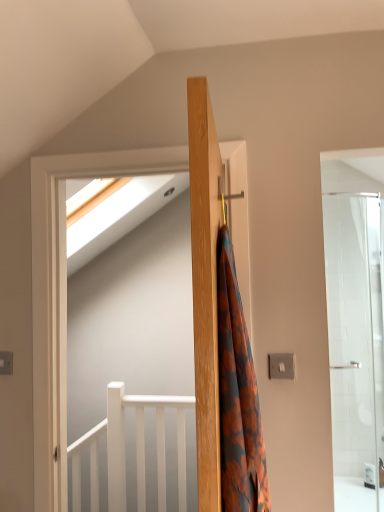
Question: From a real-world perspective, is white glossy screen door at upper left located beneath white matte balustrade at lower left?

Choices:
 (A) yes
 (B) no

Answer: (B)

Question: Is white glossy screen door at upper left outside of white matte balustrade at lower left?

Choices:
 (A) yes
 (B) no

Answer: (A)

Question: Is white glossy screen door at upper left at the left side of white matte balustrade at lower left?

Choices:
 (A) no
 (B) yes

Answer: (A)

Question: Is white glossy screen door at upper left to the right of white matte balustrade at lower left from the viewer's perspective?

Choices:
 (A) yes
 (B) no

Answer: (A)

Question: From the image's perspective, does white glossy screen door at upper left appear higher than white matte balustrade at lower left?

Choices:
 (A) yes
 (B) no

Answer: (A)

Question: Considering the relative sizes of white glossy screen door at upper left and white matte balustrade at lower left in the image provided, is white glossy screen door at upper left thinner than white matte balustrade at lower left?

Choices:
 (A) yes
 (B) no

Answer: (A)

Question: Can you confirm if orange floral fabric at center is thinner than wooden coat hanger at center?

Choices:
 (A) yes
 (B) no

Answer: (A)

Question: Would you consider orange floral fabric at center to be distant from wooden coat hanger at center?

Choices:
 (A) no
 (B) yes

Answer: (A)

Question: Is orange floral fabric at center closer to the viewer compared to wooden coat hanger at center?

Choices:
 (A) no
 (B) yes

Answer: (A)

Question: Can wooden coat hanger at center be found inside orange floral fabric at center?

Choices:
 (A) yes
 (B) no

Answer: (A)

Question: From the image's perspective, would you say orange floral fabric at center is shown under wooden coat hanger at center?

Choices:
 (A) yes
 (B) no

Answer: (A)

Question: Could you tell me if orange floral fabric at center is facing wooden coat hanger at center?

Choices:
 (A) no
 (B) yes

Answer: (B)

Question: Does white matte balustrade at lower left have a lesser height compared to white glossy screen door at upper left?

Choices:
 (A) no
 (B) yes

Answer: (B)